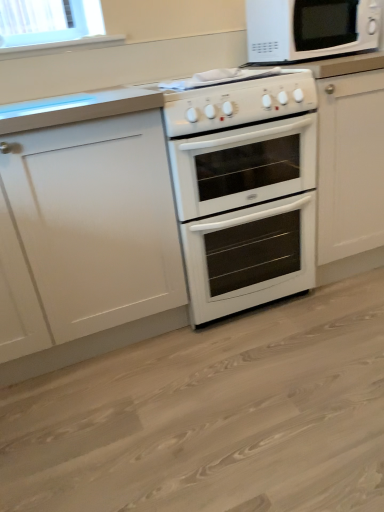
Question: From the image's perspective, does white glossy oven at center appear higher than white matte cabinet at left?

Choices:
 (A) yes
 (B) no

Answer: (B)

Question: Can you see white glossy oven at center touching white matte cabinet at left?

Choices:
 (A) no
 (B) yes

Answer: (A)

Question: Can you confirm if white glossy oven at center is taller than white matte cabinet at left?

Choices:
 (A) no
 (B) yes

Answer: (A)

Question: Is white matte cabinet at left located within white glossy oven at center?

Choices:
 (A) yes
 (B) no

Answer: (B)

Question: Does white glossy oven at center have a smaller size compared to white matte cabinet at left?

Choices:
 (A) no
 (B) yes

Answer: (B)

Question: Does white glossy oven at center turn towards white matte cabinet at left?

Choices:
 (A) yes
 (B) no

Answer: (B)

Question: From a real-world perspective, is white glossy oven at center physically below white matte cabinet at left?

Choices:
 (A) no
 (B) yes

Answer: (B)

Question: Is white glossy oven at center to the right of white matte cabinet at left from the viewer's perspective?

Choices:
 (A) yes
 (B) no

Answer: (A)

Question: Would you say white glossy oven at center is outside white matte cabinet at left?

Choices:
 (A) yes
 (B) no

Answer: (A)

Question: Is white glossy oven at center at the left side of white matte cabinet at left?

Choices:
 (A) yes
 (B) no

Answer: (B)

Question: Does white glossy oven at center have a lesser height compared to white matte cabinet at left?

Choices:
 (A) yes
 (B) no

Answer: (A)

Question: Is white glossy oven at center in contact with white matte cabinet at left?

Choices:
 (A) yes
 (B) no

Answer: (B)

Question: From the image's perspective, is white glossy gas stove at center beneath white glossy oven at center?

Choices:
 (A) no
 (B) yes

Answer: (A)